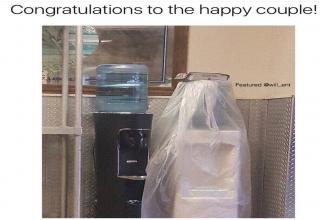
Locate an element on the screen. This screenshot has height=220, width=320. cord is located at coordinates (93, 153).